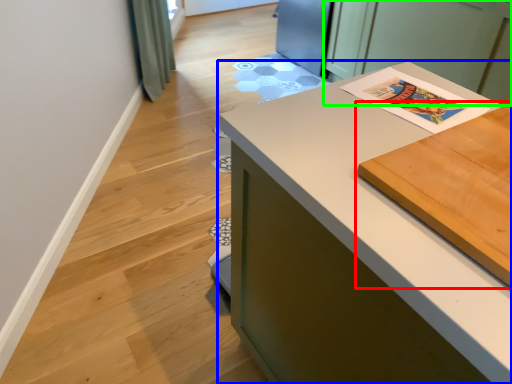
Question: Considering the real-world distances, which object is closest to table (highlighted by a red box)? countertop (highlighted by a blue box) or cabinetry (highlighted by a green box).

Choices:
 (A) countertop
 (B) cabinetry

Answer: (A)